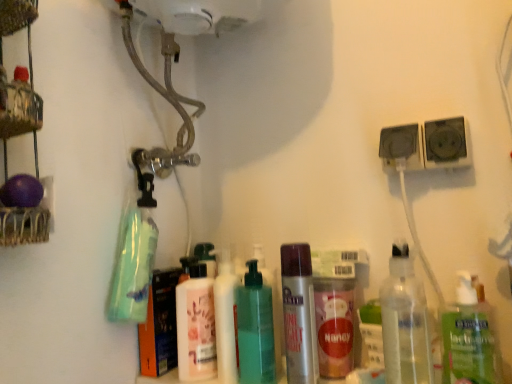
Question: In terms of height, does green translucent bottle at center, which appears as the second bottle when viewed from the left, look taller or shorter compared to clear plastic bottle at lower right, positioned as the first bottle in right-to-left order?

Choices:
 (A) tall
 (B) short

Answer: (A)

Question: Is point (246, 261) closer or farther from the camera than point (454, 306)?

Choices:
 (A) farther
 (B) closer

Answer: (A)

Question: Which is farther from the pink matte lotion at center, which is the first bottle from left to right?

Choices:
 (A) clear plastic bottle at center-right, the fourth bottle in the left-to-right sequence
 (B) green matte bottle at left, arranged as the 1th cleaning product when viewed from the left
 (C) green translucent bottle at center, which is the fourth bottle in right-to-left order
 (D) clear plastic bottle at lower right, which is the 5th bottle from left to right
 (E) black plastic socket at upper right, the 2th speaker when ordered from left to right

Answer: (E)

Question: Which object is positioned closest to the black plastic socket at upper right, the first speaker from the left?

Choices:
 (A) white glossy pump bottle at center, acting as the 1th cleaning product starting from the right
 (B) green matte bottle at left, arranged as the 1th cleaning product when viewed from the left
 (C) green translucent bottle at center, which is the fourth bottle in right-to-left order
 (D) black plastic socket at upper right, the 2th speaker when ordered from left to right
 (E) clear plastic bottle at lower right, positioned as the first bottle in right-to-left order

Answer: (D)